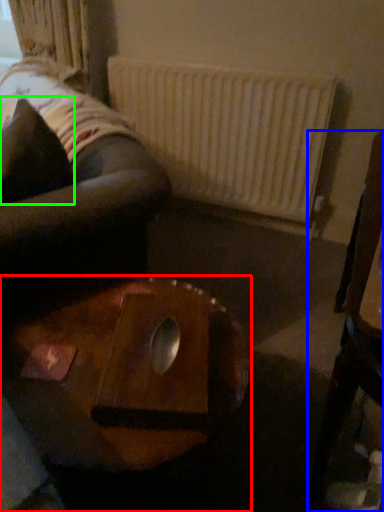
Question: Based on their relative distances, which object is nearer to table (highlighted by a red box)? Choose from furniture (highlighted by a blue box) and pillow (highlighted by a green box).

Choices:
 (A) furniture
 (B) pillow

Answer: (A)